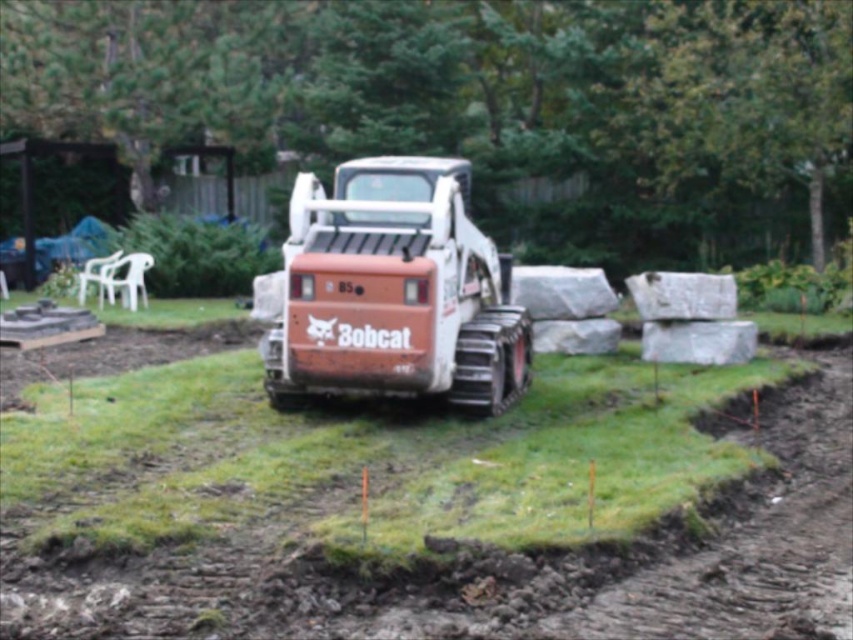
Question: Does green grass at center appear on the right side of orange matte bobcat at center?

Choices:
 (A) yes
 (B) no

Answer: (B)

Question: Which point is farther from the camera taking this photo?

Choices:
 (A) (207, 468)
 (B) (372, 307)

Answer: (B)

Question: Is green grass at center closer to the viewer compared to orange matte bobcat at center?

Choices:
 (A) no
 (B) yes

Answer: (B)

Question: Can you confirm if green grass at center is positioned below orange matte bobcat at center?

Choices:
 (A) yes
 (B) no

Answer: (A)

Question: Which point is closer to the camera?

Choices:
 (A) (426, 337)
 (B) (158, 493)

Answer: (B)